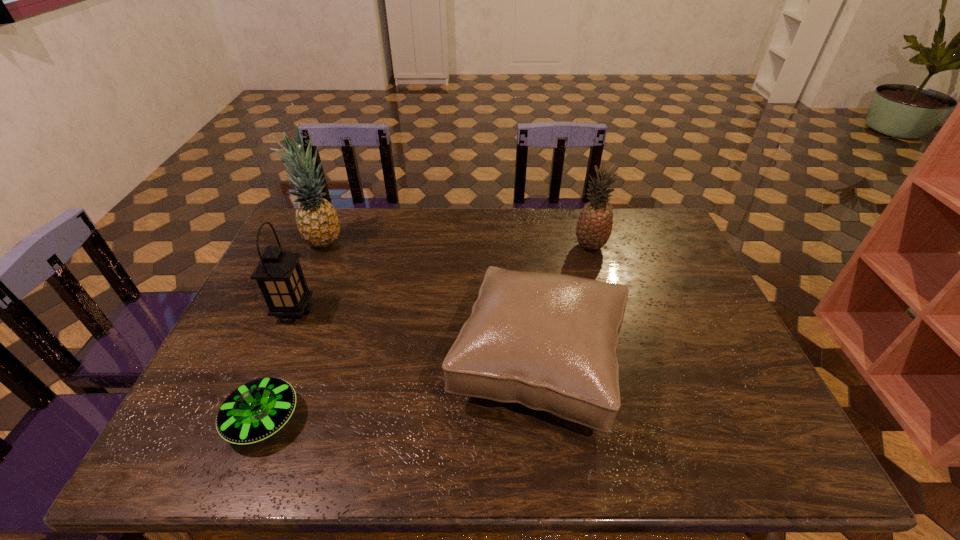
The image size is (960, 540). I want to click on free space between the taller pineapple and the cushion, so click(x=429, y=302).

Image resolution: width=960 pixels, height=540 pixels. I want to click on empty space that is in between the shortest object and the second shortest object, so click(x=400, y=392).

Where is `free spot between the lantern and the saucer`? Image resolution: width=960 pixels, height=540 pixels. free spot between the lantern and the saucer is located at coordinates (278, 366).

Where is `vacant area that lies between the lantern and the right pineapple`? vacant area that lies between the lantern and the right pineapple is located at coordinates 443,279.

Locate which object ranks second in proximity to the tallest object. Please provide its 2D coordinates. Your answer should be formatted as a tuple, i.e. [(x, y)], where the tuple contains the x and y coordinates of a point satisfying the conditions above.

[(548, 341)]

You are a GUI agent. You are given a task and a screenshot of the screen. Output one action in this format:
    pyautogui.click(x=<x>, y=<y>)
    Task: Click on the object that is the fourth closest to the second shortest object
    
    Given the screenshot: What is the action you would take?
    pyautogui.click(x=317, y=221)